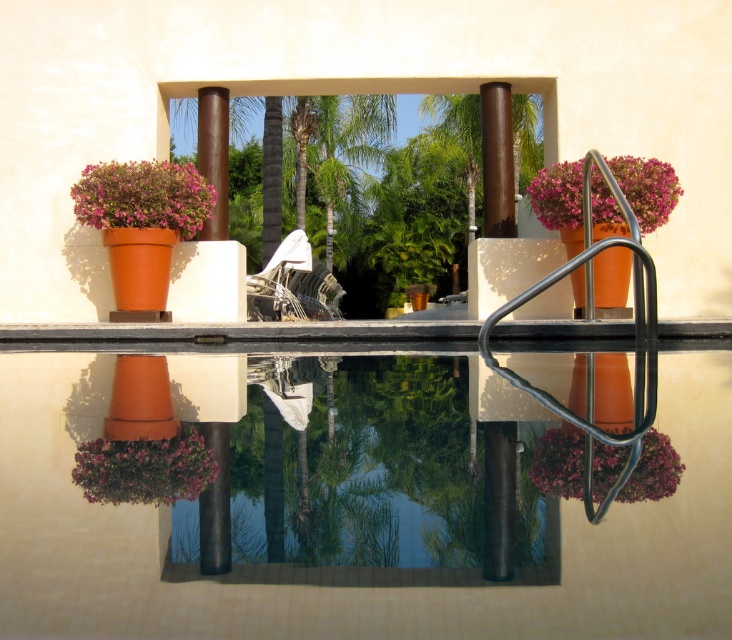
You are standing at the edge of the poolside area and want to place a 2 meter long ladder between the matte terracotta pot at left and the dark brown column. Can the ladder fit between them?

The distance between the matte terracotta pot at left and the viewer is 6.62 meters, but the question is about the distance between the matte terracotta pot at left and the dark brown column. Since the Objects Description only provides the distance between the pot and the viewer, we cannot determine if the ladder can fit between the pot and the column based on the given information.

You are standing at the edge of the pool and want to place a floating decoration exactly at the center of the transparent glass water at center. According to the coordinates provided, where should you place it?

The transparent glass water at center should be placed at coordinates point (x=370, y=476).

You are a gardener who wants to place a new statue that is 1.2 meters tall between the transparent glass water at center and the purple matte flower pot at lower left. Based on the scene, will the statue be taller than both objects?

The transparent glass water at center is taller than the purple matte flower pot at lower left. Since the statue is 1.2 meters tall, we need to know the height of the tallest object. However, the exact heights aren not provided. Therefore, it is impossible to determine if the statue will be taller than both objects without additional information.